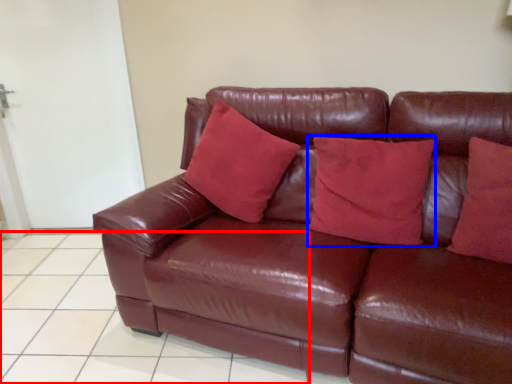
Question: Which of the following is the farthest to the observer, tile (highlighted by a red box) or pillow (highlighted by a blue box)?

Choices:
 (A) tile
 (B) pillow

Answer: (A)